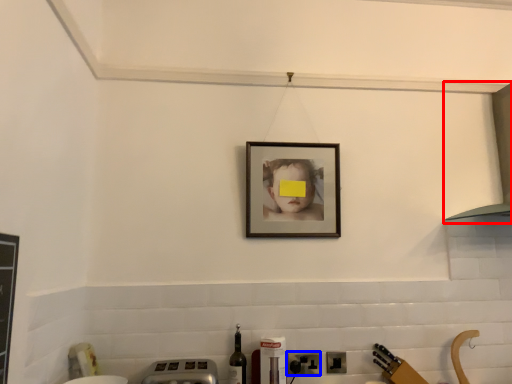
Question: Among these objects, which one is nearest to the camera, exhaust hood (highlighted by a red box) or electric outlet (highlighted by a blue box)?

Choices:
 (A) exhaust hood
 (B) electric outlet

Answer: (A)